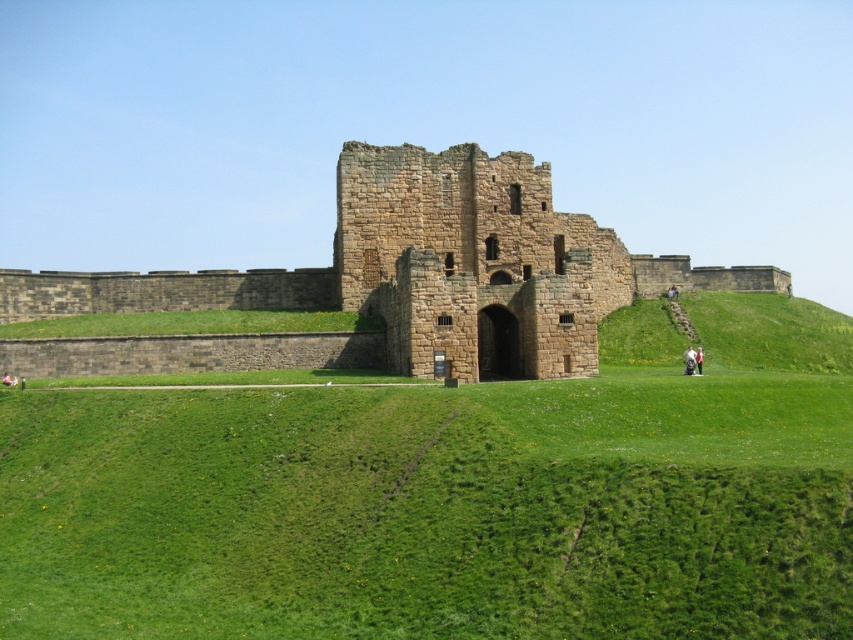
Does green grassy at center appear under brown stone castle at center?

Indeed, green grassy at center is positioned under brown stone castle at center.

Image resolution: width=853 pixels, height=640 pixels. I want to click on green grassy at center, so click(x=431, y=509).

What are the coordinates of `green grassy at center` in the screenshot? It's located at pos(431,509).